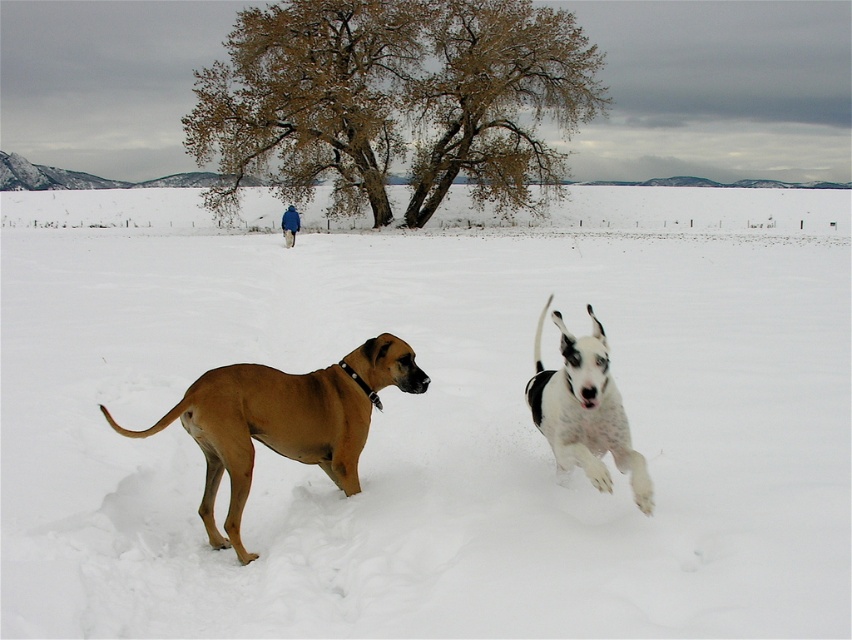
Can you confirm if white fluffy snow at center is smaller than white speckled fur at center?

Incorrect, white fluffy snow at center is not smaller in size than white speckled fur at center.

Is white fluffy snow at center bigger than white speckled fur at center?

Correct, white fluffy snow at center is larger in size than white speckled fur at center.

Between point (757, 436) and point (603, 339), which one is positioned behind?

The point (757, 436) is more distant.

This screenshot has height=640, width=852. Find the location of `white fluffy snow at center`. white fluffy snow at center is located at coordinates (430, 419).

Does brown smooth dog at center lie in front of blue fleece jacket at center?

That is True.

Which is below, brown smooth dog at center or blue fleece jacket at center?

brown smooth dog at center is below.

The height and width of the screenshot is (640, 852). Identify the location of brown smooth dog at center. [285, 420].

Looking at this image, who is positioned more to the left, brown leafy tree at upper center or blue fleece jacket at center?

blue fleece jacket at center

From the picture: Who is more forward, (482, 104) or (292, 225)?

Point (292, 225) is in front.

Where is `brown leafy tree at upper center`? Image resolution: width=852 pixels, height=640 pixels. brown leafy tree at upper center is located at coordinates (394, 99).